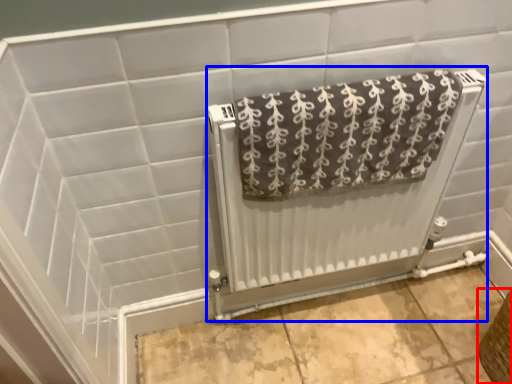
Question: Which object is further to the camera taking this photo, basket (highlighted by a red box) or radiator (highlighted by a blue box)?

Choices:
 (A) basket
 (B) radiator

Answer: (A)